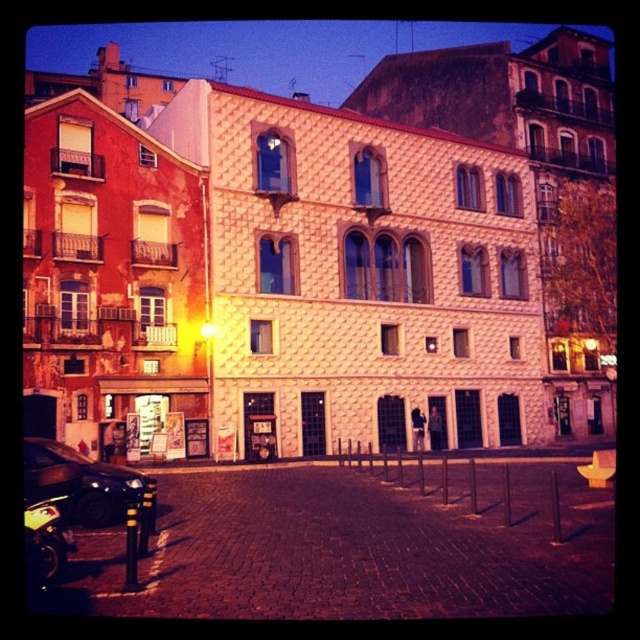
Question: Among these objects, which one is farthest from the camera?

Choices:
 (A) shiny black motorcycle at lower left
 (B) shiny black car at lower left

Answer: (B)

Question: In this image, where is shiny black car at lower left located relative to shiny black motorcycle at lower left?

Choices:
 (A) below
 (B) above

Answer: (B)

Question: Is shiny black car at lower left positioned before shiny black motorcycle at lower left?

Choices:
 (A) no
 (B) yes

Answer: (A)

Question: Which point is farther to the camera?

Choices:
 (A) shiny black motorcycle at lower left
 (B) shiny black car at lower left

Answer: (B)

Question: Is shiny black car at lower left behind shiny black motorcycle at lower left?

Choices:
 (A) no
 (B) yes

Answer: (B)